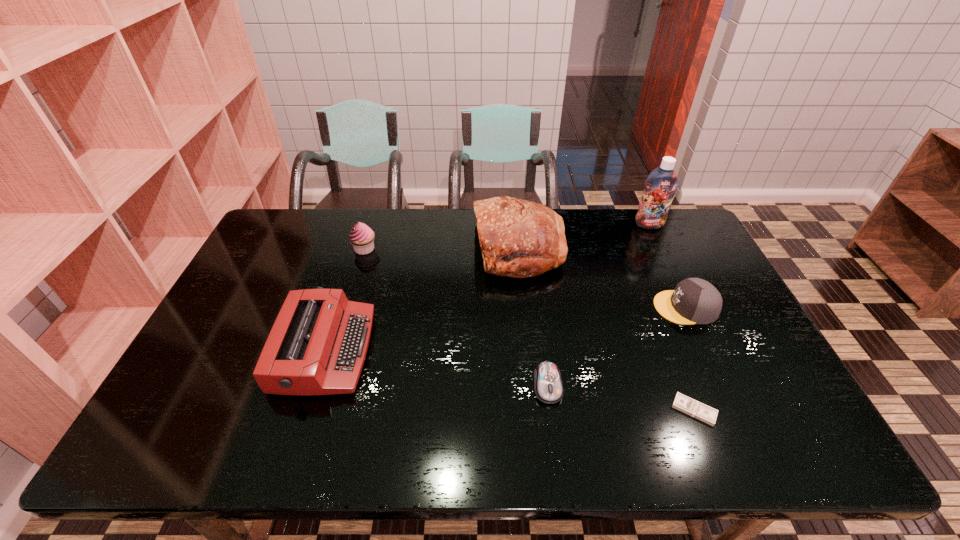
Where is `vacant space at the near right corner`? This screenshot has width=960, height=540. vacant space at the near right corner is located at coordinates (820, 458).

The width and height of the screenshot is (960, 540). In order to click on vacant region between the typewriter and the shortest object in this screenshot , I will do (510, 380).

Locate an element on the screen. Image resolution: width=960 pixels, height=540 pixels. vacant space that is in between the second shortest object and the fifth shortest object is located at coordinates (456, 317).

You are a GUI agent. You are given a task and a screenshot of the screen. Output one action in this format:
    pyautogui.click(x=<x>, y=<y>)
    Task: Click on the free area in between the typewriter and the fifth tallest object
    The height and width of the screenshot is (540, 960).
    Given the screenshot: What is the action you would take?
    pyautogui.click(x=505, y=329)

Locate an element on the screen. This screenshot has height=540, width=960. free spot between the cap and the shortest object is located at coordinates (689, 359).

The width and height of the screenshot is (960, 540). I want to click on free space between the cupcake and the computer mouse, so pos(456,317).

Image resolution: width=960 pixels, height=540 pixels. Find the location of `free space between the money and the fourth shortest object`. free space between the money and the fourth shortest object is located at coordinates (510, 380).

Locate an element on the screen. The height and width of the screenshot is (540, 960). free space between the third tallest object and the second shortest object is located at coordinates (456, 317).

This screenshot has width=960, height=540. What are the coordinates of `object that stands as the sixth closest to the fourth shortest object` in the screenshot? It's located at (660, 186).

Find the location of a particular element. object that is the second closest one to the cap is located at coordinates (518, 238).